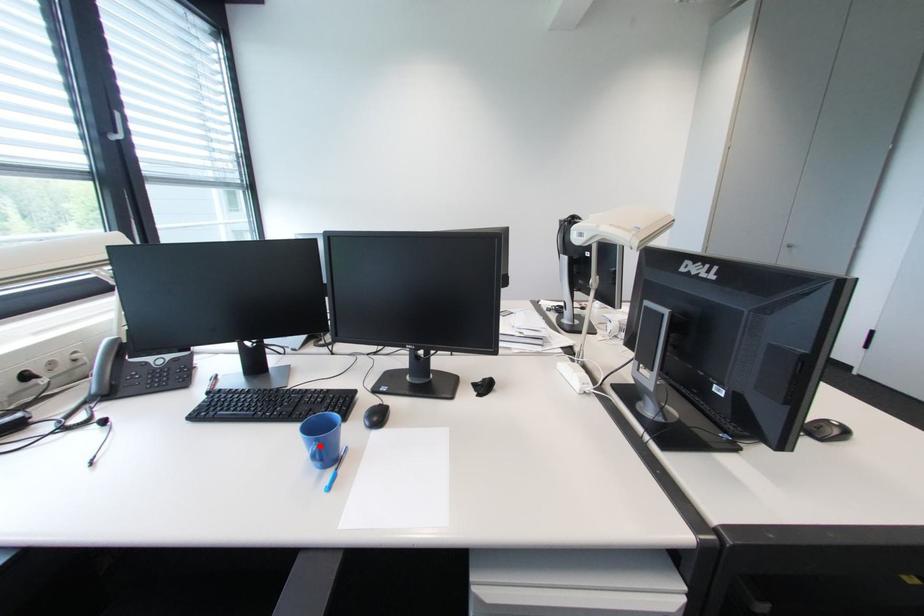
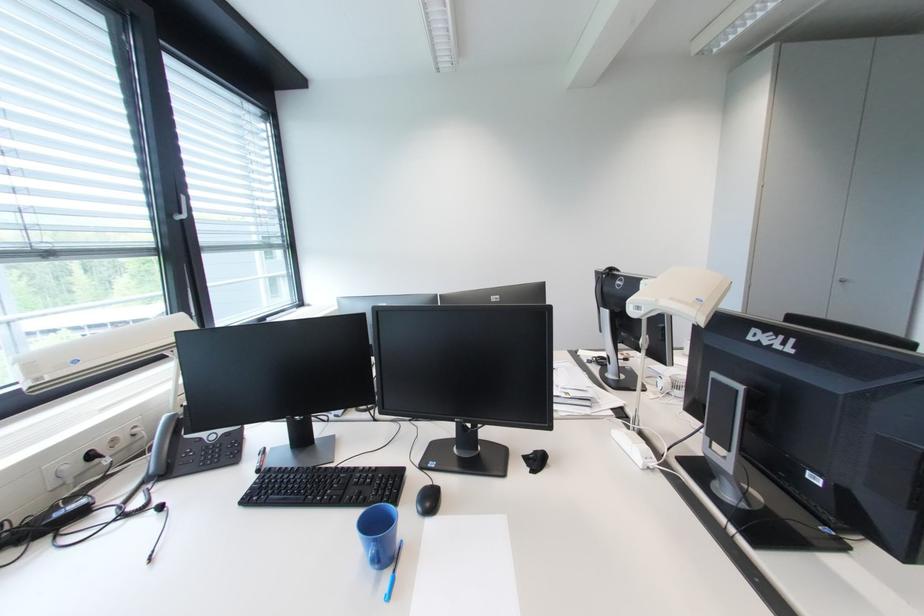
Where in the second image is the point corresponding to the highlighted location from the first image?

(379, 546)